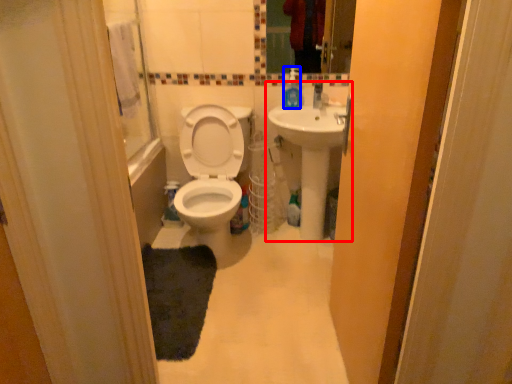
Question: Which of the following is the farthest to the observer, sink (highlighted by a red box) or soap dispenser (highlighted by a blue box)?

Choices:
 (A) sink
 (B) soap dispenser

Answer: (B)